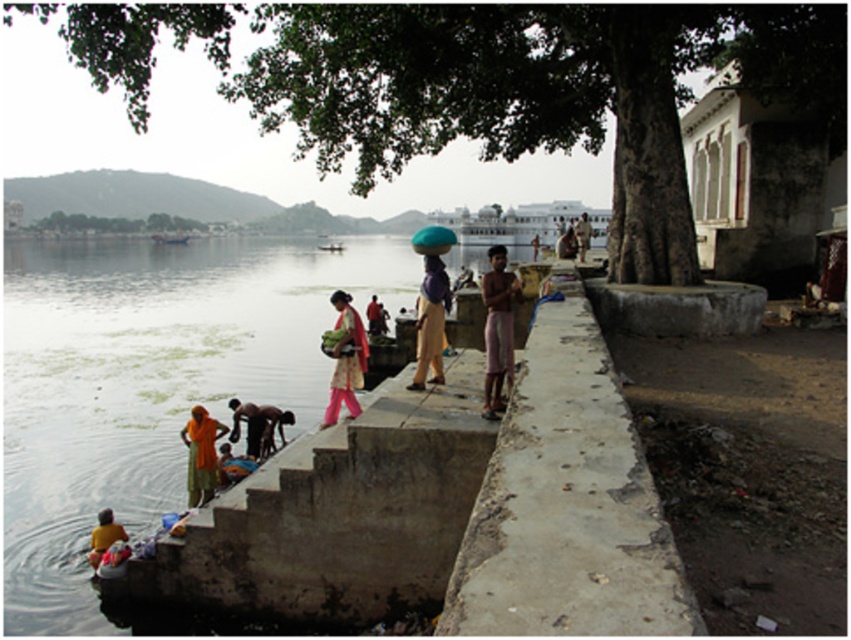
Question: Where is purple fabric bag at center located in relation to orange fabric cloth at lower left in the image?

Choices:
 (A) below
 (B) above

Answer: (B)

Question: Which object is closer to the camera taking this photo?

Choices:
 (A) orange fabric cloth at lower left
 (B) clear water at river left
 (C) pink cotton shorts at center
 (D) yellow fabric at lower left

Answer: (C)

Question: Is clear water at river left wider than yellow fabric at lower left?

Choices:
 (A) yes
 (B) no

Answer: (A)

Question: Is pink fabric cloth at center thinner than dark brown skin at lower left?

Choices:
 (A) no
 (B) yes

Answer: (A)

Question: Which point is closer to the camera?

Choices:
 (A) yellow fabric at lower left
 (B) dark brown skin at lower left

Answer: (A)

Question: Which object appears farthest from the camera in this image?

Choices:
 (A) pink cotton shorts at center
 (B) yellow fabric at lower left

Answer: (B)